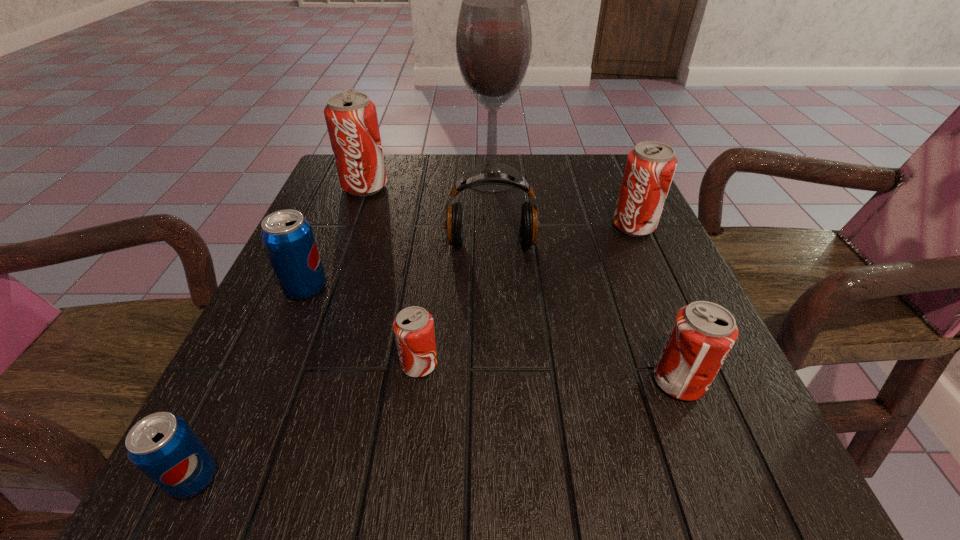
At what (x,y) coordinates should I click in order to perform the action: click on the fourth pop soda from left to right. Please return your answer as a coordinate pair (x, y). The height and width of the screenshot is (540, 960). Looking at the image, I should click on (413, 327).

Where is `the second pink soda can from left to right`? the second pink soda can from left to right is located at coordinates (413, 327).

At what (x,y) coordinates should I click in order to perform the action: click on the smaller blue pop soda. Please return your answer as a coordinate pair (x, y). Looking at the image, I should click on (163, 446).

The image size is (960, 540). What are the coordinates of `the nearest pop soda` in the screenshot? It's located at (163, 446).

I want to click on blank area located on the right of the red alcohol, so click(x=541, y=177).

This screenshot has width=960, height=540. I want to click on vacant space located on the front of the biggest pink soda can, so click(x=350, y=225).

Where is `vacant space located 0.070m on the back of the fifth shortest pop soda`? vacant space located 0.070m on the back of the fifth shortest pop soda is located at coordinates (621, 198).

The image size is (960, 540). I want to click on free space located on the ear cups of the headset, so click(497, 423).

The image size is (960, 540). Find the location of `free space located on the back of the fifth farthest object`. free space located on the back of the fifth farthest object is located at coordinates (352, 179).

Identify the location of vacant area situated 0.330m on the back of the third biggest pink soda can. (622, 239).